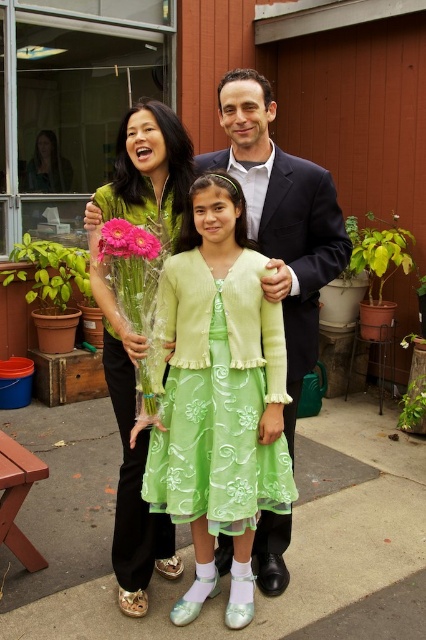
You are a photographer taking a picture of the family. You need to place a decorative ribbon exactly at the point marked by the coordinates point (135, 333). According to the scene description, which family member should you place the ribbon near?

The point (135, 333) marks the matte green dress at left, so you should place the ribbon near the woman on the left.

From the picture: You are a photographer trying to frame a shot that includes both the dark blue suit at center and the pink matte gerbera at center. Based on their sizes, which object should you adjust your camera angle to ensure both are fully visible?

The dark blue suit at center is wider than the pink matte gerbera at center, so you should adjust your camera angle to accommodate the larger width of the dark blue suit at center to ensure both are fully visible.

You are a photographer trying to capture the matte green dress at left in the center of your camera frame. Given that the camera frame is a rectangle with coordinates from 0 to 1 on both axes, can you determine if the dress is already centered?

The 2D location of the matte green dress at left is at point (135, 333). Since the center of the frame is at (213, 320), the dress is slightly to the left and below the center point. Therefore, it is not perfectly centered.